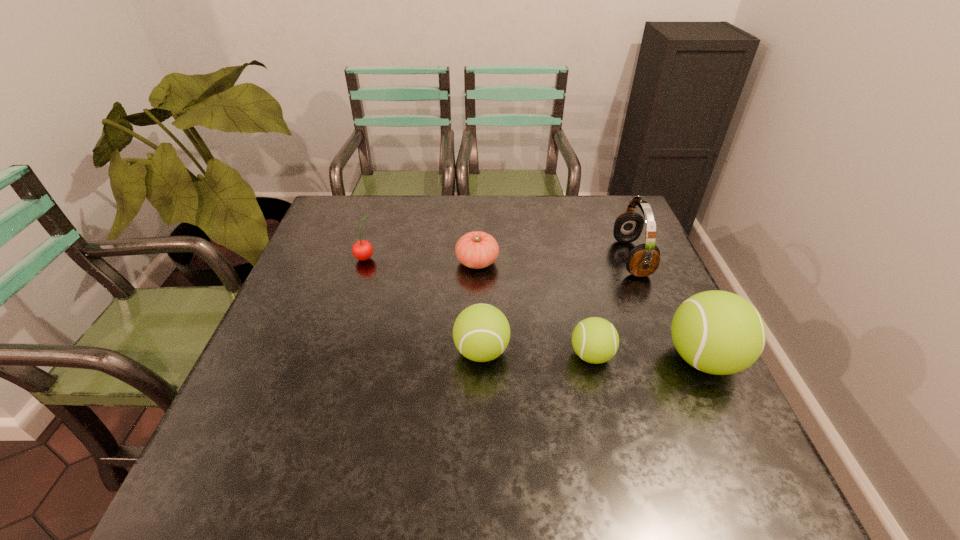
You are a GUI agent. You are given a task and a screenshot of the screen. Output one action in this format:
    pyautogui.click(x=<x>, y=<y>)
    Task: Click on the second shortest tennis ball
    This screenshot has height=540, width=960.
    Given the screenshot: What is the action you would take?
    pyautogui.click(x=481, y=332)

You are a GUI agent. You are given a task and a screenshot of the screen. Output one action in this format:
    pyautogui.click(x=<x>, y=<y>)
    Task: Click on the shortest tennis ball
    Image resolution: width=960 pixels, height=540 pixels.
    Given the screenshot: What is the action you would take?
    pyautogui.click(x=595, y=340)

Find the location of a particular element. The image size is (960, 540). the fourth object from left to right is located at coordinates (595, 340).

What are the coordinates of `the rightmost tennis ball` in the screenshot? It's located at (717, 332).

You are a GUI agent. You are given a task and a screenshot of the screen. Output one action in this format:
    pyautogui.click(x=<x>, y=<y>)
    Task: Click on the headset
    The width and height of the screenshot is (960, 540).
    Given the screenshot: What is the action you would take?
    pyautogui.click(x=643, y=260)

What are the coordinates of `tomato` in the screenshot? It's located at (476, 250).

Find the location of a particular element. the leftmost object is located at coordinates (362, 250).

At what (x,y) coordinates should I click in order to perform the action: click on blank space located on the right of the second shortest tennis ball. Please return your answer as a coordinate pair (x, y). Looking at the image, I should click on (571, 352).

The image size is (960, 540). Find the location of `vacant space located 0.230m on the back of the third object from right to left`. vacant space located 0.230m on the back of the third object from right to left is located at coordinates (572, 274).

Find the location of `vacant space located 0.210m on the left of the rightmost tennis ball`. vacant space located 0.210m on the left of the rightmost tennis ball is located at coordinates (569, 359).